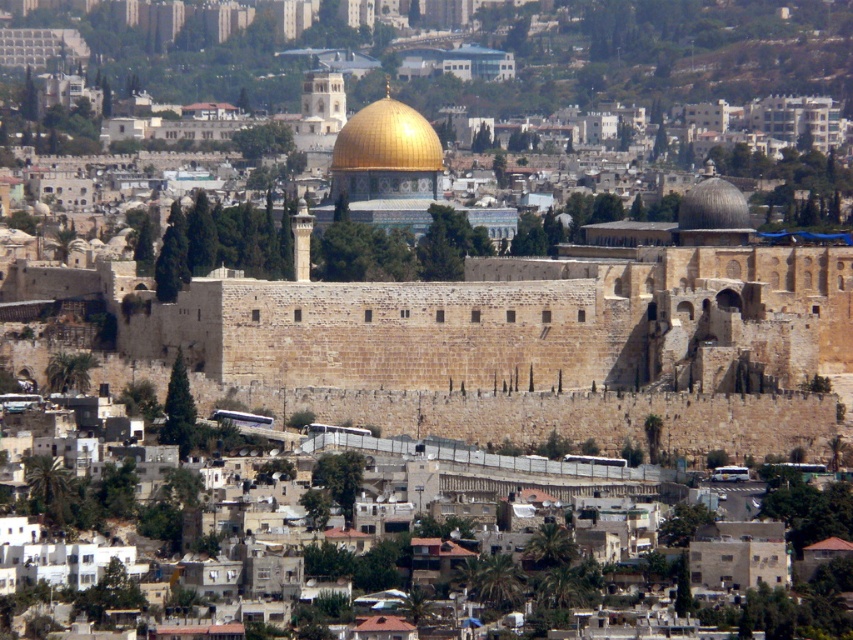
You are an architect analyzing the spatial relationships in this historic cityscape. You observe the gold shiny dome at center and the smooth stone dome at upper right. Which dome is closer to your viewpoint?

The gold shiny dome at center is closer to the viewer than the smooth stone dome at upper right.

You are an architect analyzing the cityscape. You notice the gold shiny dome at center and the smooth stone dome at upper right. Which dome has a greater height?

The smooth stone dome at upper right is taller than the gold shiny dome at center.

You are an architect analyzing the city layout. You need to determine the exact position of the gold shiny dome at center in the image. What are its coordinates?

The gold shiny dome at center is located at coordinates (387, 140).